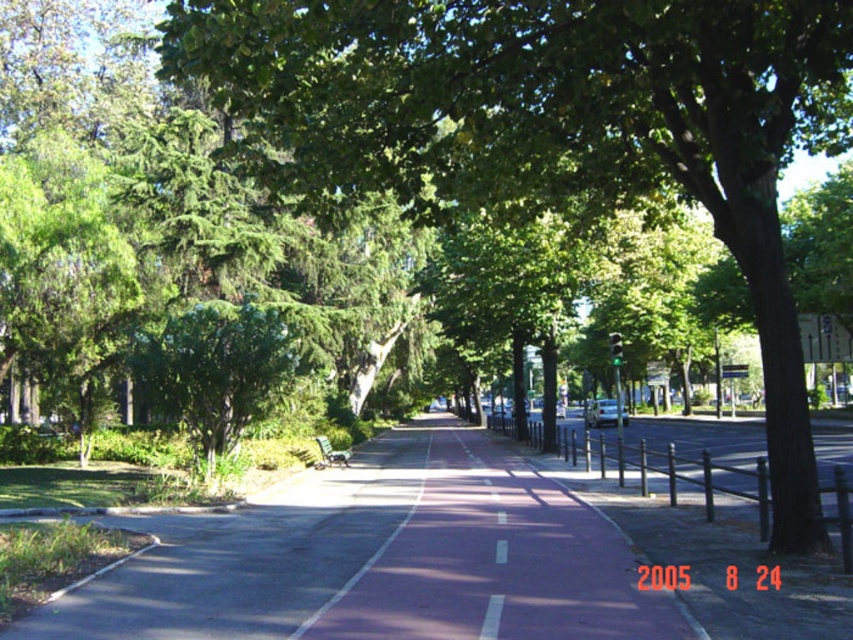
Who is more distant from viewer, (660,77) or (338,468)?

Point (338,468)

You are a GUI agent. You are given a task and a screenshot of the screen. Output one action in this format:
    pyautogui.click(x=<x>, y=<y>)
    Task: Click on the green leafy tree at center
    
    Given the screenshot: What is the action you would take?
    pyautogui.click(x=556, y=125)

Who is more forward, (724,134) or (102,630)?

Point (102,630) is more forward.

This screenshot has height=640, width=853. Identify the location of green leafy tree at center. (556, 125).